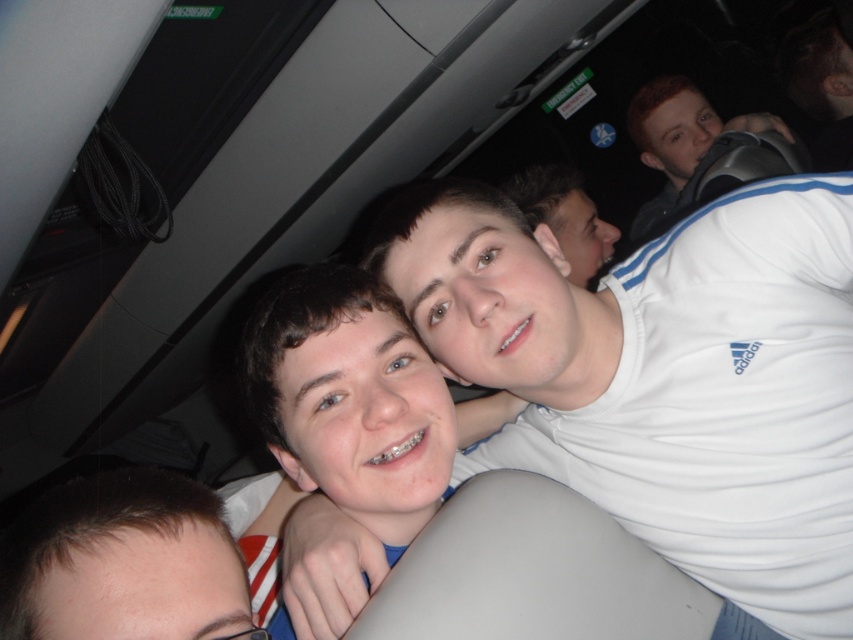
What is located at the coordinate point marked as (x=350, y=397) in the image?

The smooth skin face at center is located at the coordinate point marked as (x=350, y=397).

You are a photographer trying to capture a clear shot of the smooth skin face at center. The camera is positioned at point (350, 397). What is the subject of your photo?

The subject of the photo is the smooth skin face at center located at point (350, 397).

You are standing 30 inches away from the vehicle. Can you reach the point at coordinates point (392, 372) without moving closer?

The point at coordinates point (392, 372) is 28.87 inches away from the viewer. Since you are currently 30 inches away, you are slightly farther than the point. To reach it, you would need to move 1.13 inches closer.